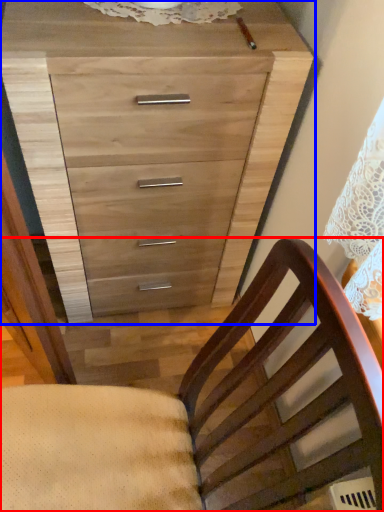
Question: Which of the following is the farthest to the observer, chair (highlighted by a red box) or chest of drawers (highlighted by a blue box)?

Choices:
 (A) chair
 (B) chest of drawers

Answer: (B)